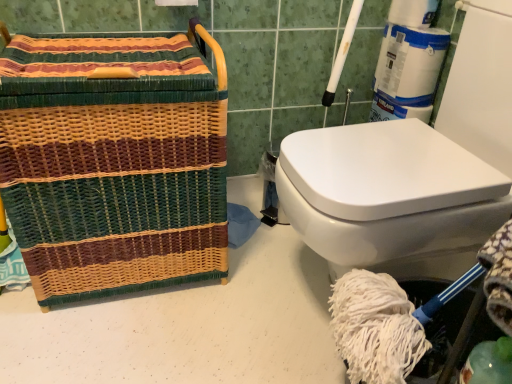
Question: Is teal glass at lower right taller than woven multicolored basket at left?

Choices:
 (A) no
 (B) yes

Answer: (A)

Question: Is teal glass at lower right beside woven multicolored basket at left?

Choices:
 (A) yes
 (B) no

Answer: (B)

Question: Does teal glass at lower right appear on the left side of woven multicolored basket at left?

Choices:
 (A) yes
 (B) no

Answer: (B)

Question: From the image's perspective, is teal glass at lower right above woven multicolored basket at left?

Choices:
 (A) yes
 (B) no

Answer: (B)

Question: Can you confirm if teal glass at lower right is thinner than woven multicolored basket at left?

Choices:
 (A) no
 (B) yes

Answer: (B)

Question: Is teal glass at lower right positioned beyond the bounds of woven multicolored basket at left?

Choices:
 (A) no
 (B) yes

Answer: (B)

Question: Is the depth of woven multicolored basket at left greater than that of teal glass at lower right?

Choices:
 (A) no
 (B) yes

Answer: (B)

Question: Is teal glass at lower right inside woven multicolored basket at left?

Choices:
 (A) yes
 (B) no

Answer: (B)

Question: From the image's perspective, does woven multicolored basket at left appear higher than teal glass at lower right?

Choices:
 (A) yes
 (B) no

Answer: (A)

Question: Does woven multicolored basket at left have a smaller size compared to teal glass at lower right?

Choices:
 (A) no
 (B) yes

Answer: (A)

Question: Is woven multicolored basket at left not inside teal glass at lower right?

Choices:
 (A) yes
 (B) no

Answer: (A)

Question: From the image's perspective, does woven multicolored basket at left appear lower than teal glass at lower right?

Choices:
 (A) yes
 (B) no

Answer: (B)

Question: Is teal glass at lower right in front of or behind woven multicolored basket at left in the image?

Choices:
 (A) front
 (B) behind

Answer: (A)